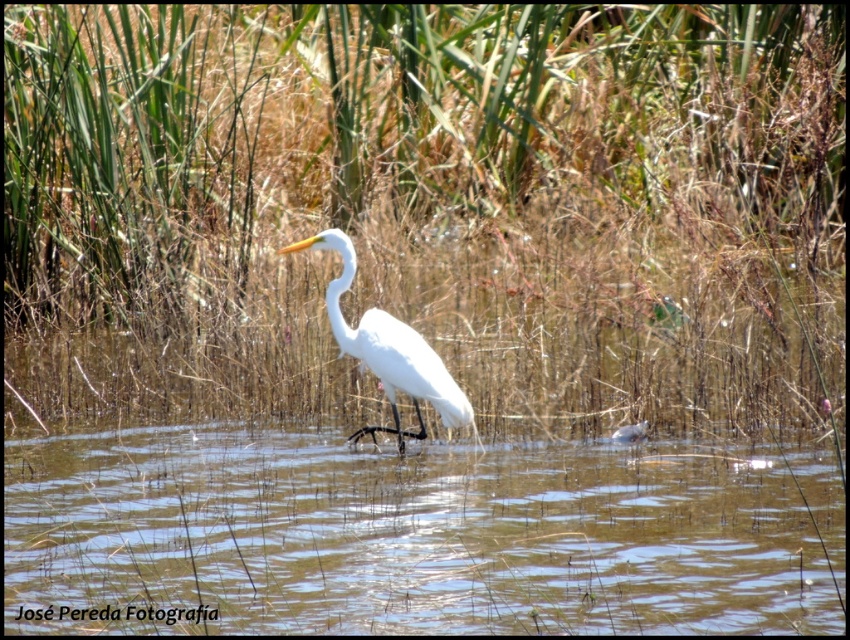
Question: Estimate the real-world distances between objects in this image. Which object is farther from the clear water at center?

Choices:
 (A) green grass at center
 (B) white smooth heron at center

Answer: (A)

Question: Is green grass at center behind white smooth heron at center?

Choices:
 (A) no
 (B) yes

Answer: (A)

Question: Does green grass at center have a smaller size compared to white smooth heron at center?

Choices:
 (A) no
 (B) yes

Answer: (A)

Question: Which object is the closest to the green grass at center?

Choices:
 (A) white smooth heron at center
 (B) clear water at center

Answer: (B)

Question: Is green grass at center further to camera compared to white smooth heron at center?

Choices:
 (A) no
 (B) yes

Answer: (A)

Question: Among these points, which one is farthest from the camera?

Choices:
 (A) (216, 465)
 (B) (517, 214)

Answer: (B)